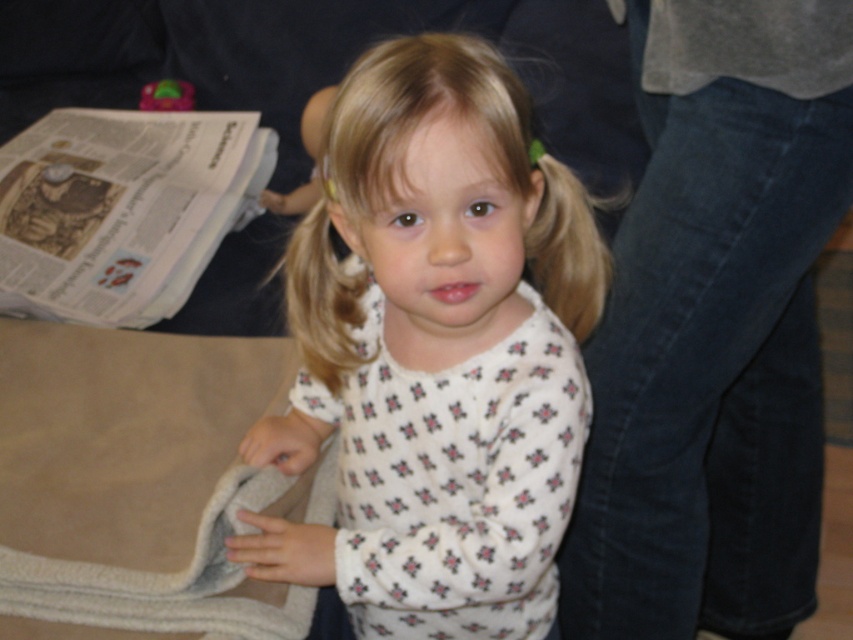
You are a photographer standing at a distance of 25 inches from the camera. You want to take a picture of the white printed shirt at center. Can you adjust your position so that you are exactly 25.62 inches away from the shirt?

The white printed shirt at center and camera are 25.62 inches apart. Since you are 25 inches away from the camera, you need to move 0.62 inches closer to the shirt to be exactly 25.62 inches away from it.

What are the exact coordinates of the white printed shirt at center in the image?

The white printed shirt at center is located at coordinates point [436,353].

Based on the scene, where is the white printed shirt at center located in relation to the white printed newspaper at upper left?

The white printed shirt at center is below the white printed newspaper at upper left.